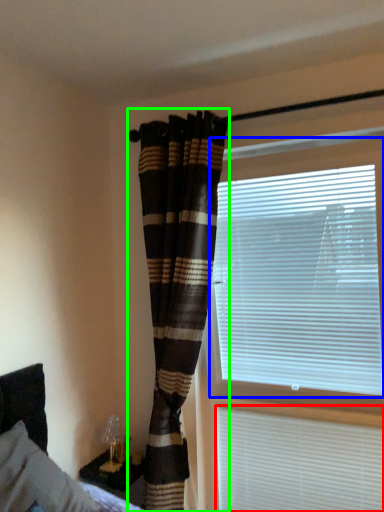
Question: Which object is positioned closest to window blind (highlighted by a red box)? Select from window blind (highlighted by a blue box) and curtain (highlighted by a green box).

Choices:
 (A) window blind
 (B) curtain

Answer: (A)